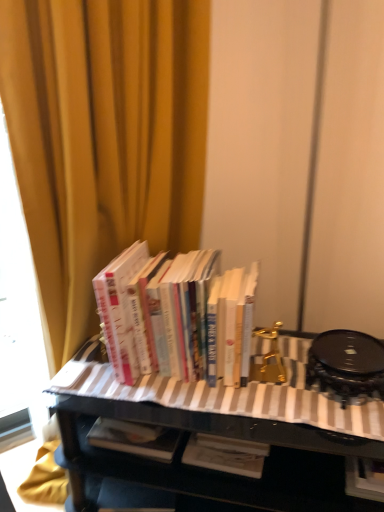
Find the location of a particular element. vacant space situated above black glossy table at center (from a real-world perspective) is located at coordinates (247, 385).